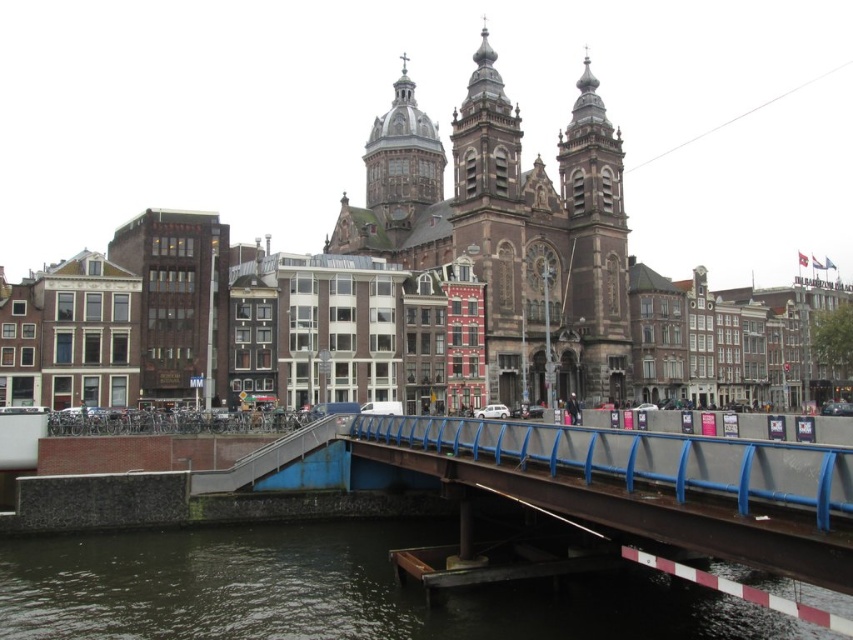
You are a tourist standing at the edge of the canal near the modern pedestrian bridge with blue railings. You want to take a photo of the brown stone church at center. Which direction should you face to capture it in your shot?

Since the brown stone church at center is located at point coordinates of 0.359 on the x axis and 0.598 on the y axis, you should face towards the central area of the image where the church is positioned to capture it in your photo.